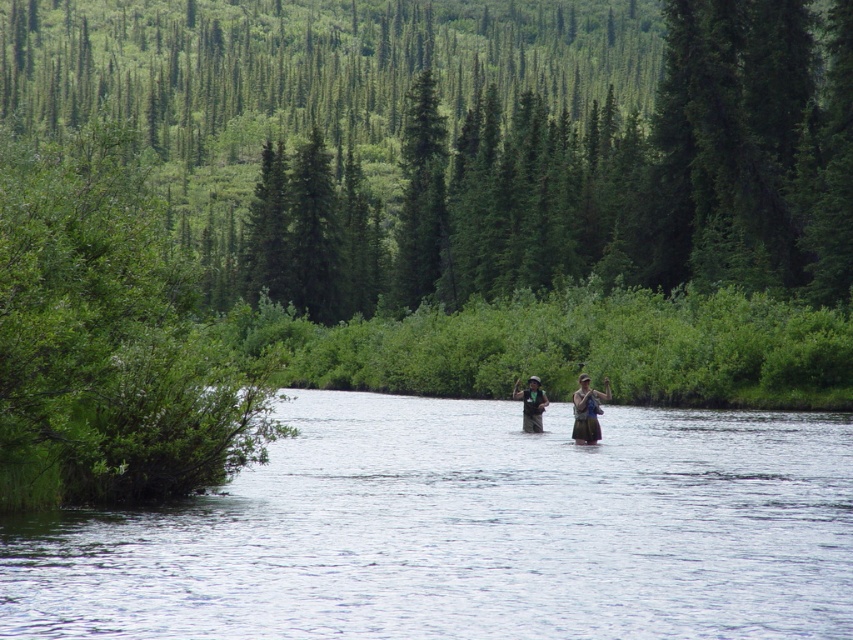
Question: Which point is closer to the camera?

Choices:
 (A) (537, 422)
 (B) (485, 573)
 (C) (593, 400)

Answer: (B)

Question: Estimate the real-world distances between objects in this image. Which object is farther from the clear water at center?

Choices:
 (A) brown fabric jacket at center
 (B) green fabric vest at center

Answer: (B)

Question: Which of these objects is positioned closest to the green fabric vest at center?

Choices:
 (A) clear water at center
 (B) brown fabric jacket at center

Answer: (B)

Question: Can you confirm if clear water at center is positioned below green fabric vest at center?

Choices:
 (A) no
 (B) yes

Answer: (B)

Question: Is the position of clear water at center less distant than that of green fabric vest at center?

Choices:
 (A) yes
 (B) no

Answer: (A)

Question: Is clear water at center below green fabric vest at center?

Choices:
 (A) no
 (B) yes

Answer: (B)